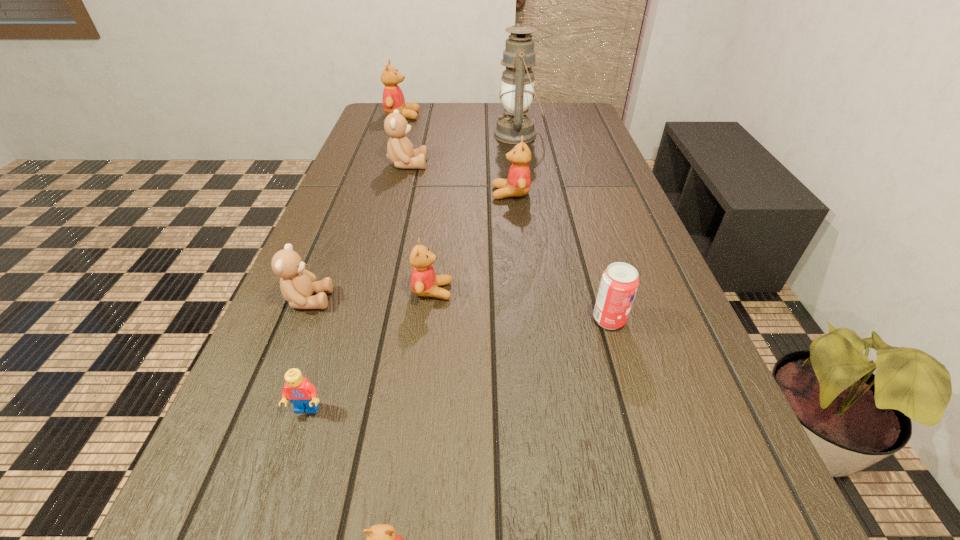
Image resolution: width=960 pixels, height=540 pixels. I want to click on vacant space at the right edge of the desktop, so click(x=649, y=400).

In the image, there is a desktop. In order to click on blank space at the far left corner in this screenshot , I will do `click(371, 130)`.

In the image, there is a desktop. At what (x,y) coordinates should I click in order to perform the action: click on vacant area at the far right corner. Please return your answer as a coordinate pair (x, y). Looking at the image, I should click on tap(546, 120).

The image size is (960, 540). In order to click on blank region between the third farthest teddy bear and the third farthest red teddy bear in this screenshot , I will do `click(471, 242)`.

The width and height of the screenshot is (960, 540). Identify the location of vacant area between the farthest teddy bear and the second smallest red teddy bear. (418, 204).

You are a GUI agent. You are given a task and a screenshot of the screen. Output one action in this format:
    pyautogui.click(x=<x>, y=<y>)
    Task: Click on the empty space between the tallest object and the farthest teddy bear
    The image size is (960, 540).
    Given the screenshot: What is the action you would take?
    pyautogui.click(x=460, y=125)

Where is `free spot between the second nearest red teddy bear and the biggest red teddy bear`? The image size is (960, 540). free spot between the second nearest red teddy bear and the biggest red teddy bear is located at coordinates (418, 204).

At what (x,y) coordinates should I click in order to perform the action: click on vacant space that is in between the second nearest object and the third farthest red teddy bear. Please return your answer as a coordinate pair (x, y). Looking at the image, I should click on (370, 350).

Choose which object is the fourth nearest neighbor to the rightmost object. Please provide its 2D coordinates. Your answer should be formatted as a tuple, i.e. [(x, y)], where the tuple contains the x and y coordinates of a point satisfying the conditions above.

[(302, 394)]

The image size is (960, 540). In order to click on object that is the closest to the brown oil lamp in this screenshot , I will do `click(518, 182)`.